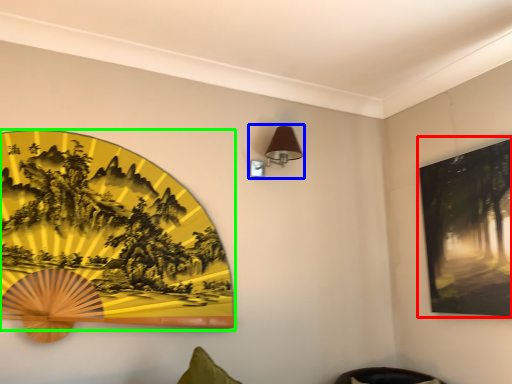
Question: Estimate the real-world distances between objects in this image. Which object is farther from picture frame (highlighted by a red box), table lamp (highlighted by a blue box) or picture frame (highlighted by a green box)?

Choices:
 (A) table lamp
 (B) picture frame

Answer: (B)